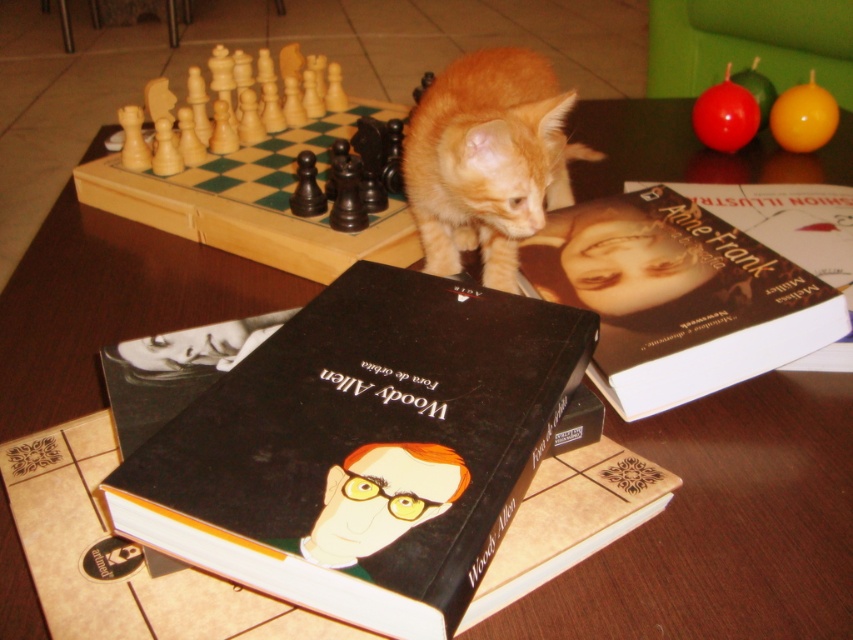
You are looking at the image and notice two points marked on the table. The first point is at coordinates point (419,612) and the second is at point (482,180). Which point is closer to you?

Point (419,612) is closer to the viewer than point (482,180).

You are organizing a bookshelf and need to place the black matte book at center and the hardcover book at upper right. Given their sizes, which book should you place first to ensure they both fit on the shelf?

The black matte book at center is smaller than the hardcover book at upper right. You should place the hardcover book at upper right first, then the smaller black matte book at center to ensure they both fit on the shelf.